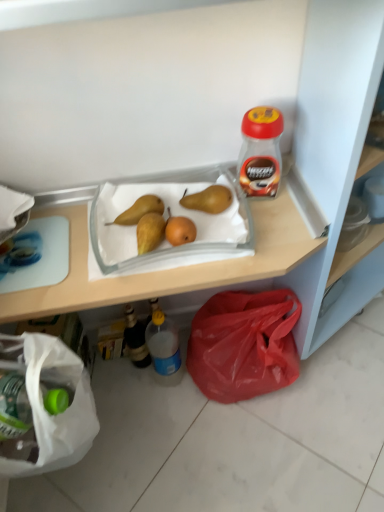
This screenshot has width=384, height=512. I want to click on vacant area that lies in front of translucent plastic bottle at lower center, which ranks as the 1th bottle in bottom-to-top order, so click(x=175, y=426).